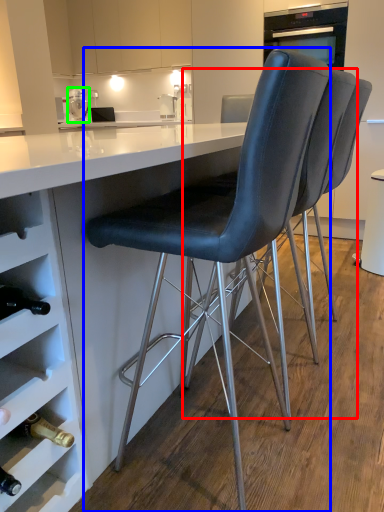
Question: Which object is the closest to the chair (highlighted by a red box)? Choose among these: chair (highlighted by a blue box) or kitchen appliance (highlighted by a green box).

Choices:
 (A) chair
 (B) kitchen appliance

Answer: (A)